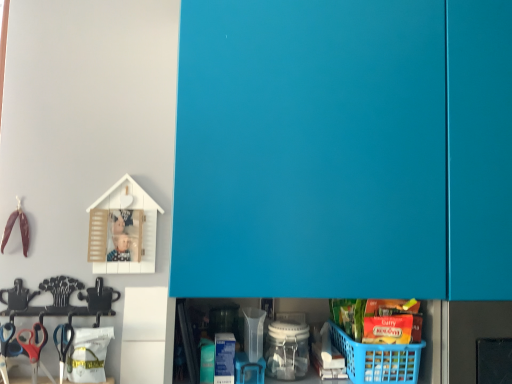
Question: In terms of height, does blue plastic basket at lower right look taller or shorter compared to teal matte cabinet doors at upper center?

Choices:
 (A) tall
 (B) short

Answer: (B)

Question: In terms of size, does blue plastic basket at lower right appear bigger or smaller than teal matte cabinet doors at upper center?

Choices:
 (A) small
 (B) big

Answer: (A)

Question: Based on their relative distances, which object is farther from the pink plastic scissors at lower left?

Choices:
 (A) blue plastic basket at lower right
 (B) teal matte cabinet doors at upper center

Answer: (B)

Question: Which object is positioned farthest from the blue plastic basket at lower right?

Choices:
 (A) pink plastic scissors at lower left
 (B) teal matte cabinet doors at upper center

Answer: (A)